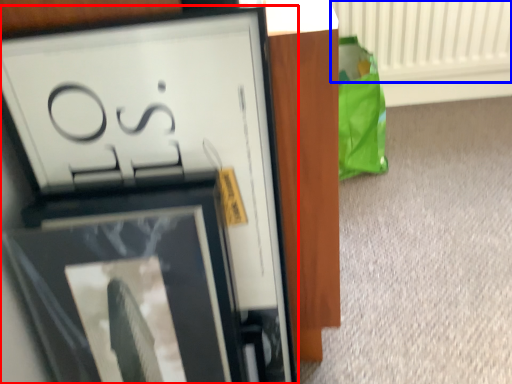
Question: Which point is closer to the camera, picture frame (highlighted by a red box) or radiator (highlighted by a blue box)?

Choices:
 (A) picture frame
 (B) radiator

Answer: (A)